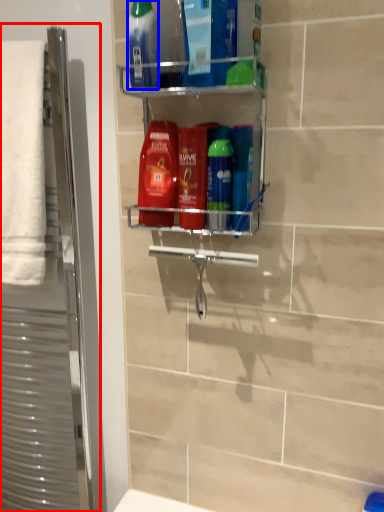
Question: Which of the following is the farthest to the observer, screen door (highlighted by a red box) or mouthwash (highlighted by a blue box)?

Choices:
 (A) screen door
 (B) mouthwash

Answer: (A)